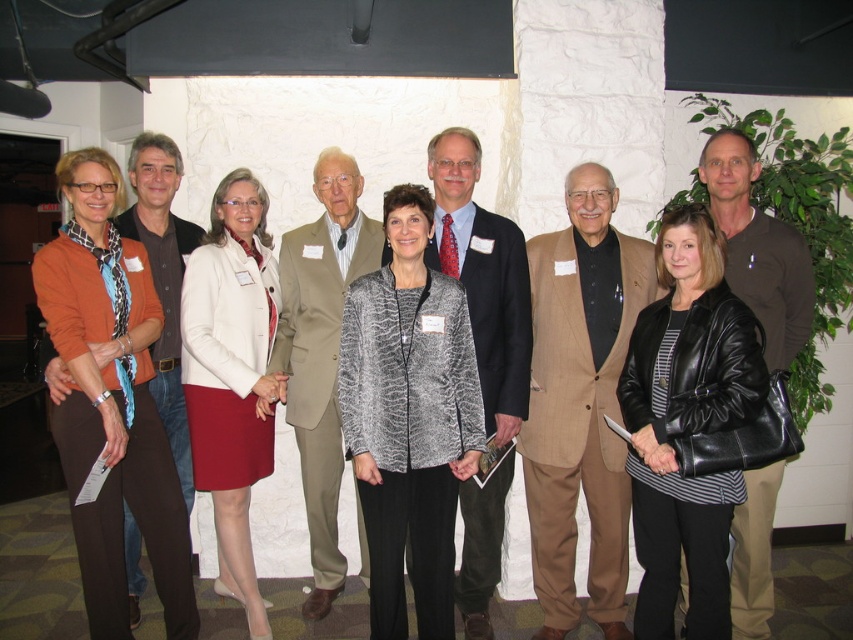
Can you confirm if matte orange sweater at left is smaller than textured gray blazer at center?

Actually, matte orange sweater at left might be larger than textured gray blazer at center.

Does matte orange sweater at left appear over textured gray blazer at center?

Indeed, matte orange sweater at left is positioned over textured gray blazer at center.

Where is `matte orange sweater at left`? matte orange sweater at left is located at coordinates (109, 401).

Can you confirm if tan pinstripe suit at center is thinner than black leather jacket at center?

No.

Between point (579, 189) and point (653, 589), which one is positioned behind?

Positioned behind is point (579, 189).

Which is behind, point (538, 586) or point (643, 346)?

Point (538, 586)

This screenshot has width=853, height=640. I want to click on tan pinstripe suit at center, so click(x=579, y=401).

Does light brown suit at center appear under brown leather jacket at center?

Yes.

Is light brown suit at center to the left of brown leather jacket at center from the viewer's perspective?

Correct, you'll find light brown suit at center to the left of brown leather jacket at center.

Who is more distant from viewer, [296,342] or [811,298]?

Positioned behind is point [296,342].

This screenshot has height=640, width=853. Identify the location of light brown suit at center. (321, 352).